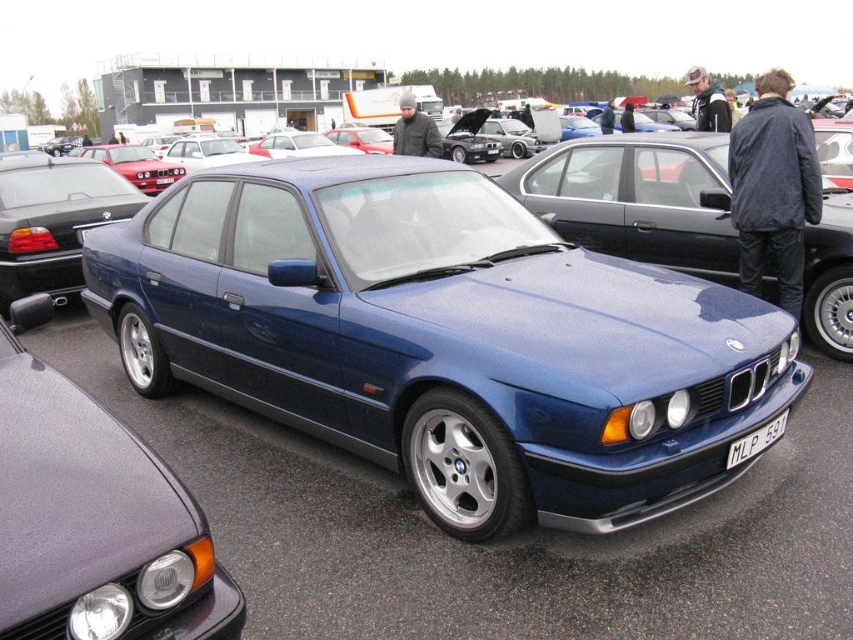
You are a photographer at the car exhibition. You want to take a photo of both the metallic blue sedan at center and the satin blue sedan at center. Which one should you focus on first if you want to capture the one on the left side of the image?

The satin blue sedan at center is on the left side of the metallic blue sedan at center, so you should focus on the satin blue sedan at center first to capture the one on the left side of the image.

Consider the image. You are a photographer at a car exhibition. You need to position a camera tripod between the metallic blue sedan at center and the satin blue sedan at center so that it can capture both cars in the frame. Given that the distance between them is exactly 3 meters, and the tripod requires at least 1 meter of space to the left and right for stability, will this setup work?

The metallic blue sedan at center is shorter than the satin blue sedan at center. However, the question is about positioning the tripod between them based on distance, not height. Since the distance between them is 3 meters and the tripod needs 1 meter on each side, totaling 2 meters, there is sufficient space. The setup will work as the available distance exceeds the required space.